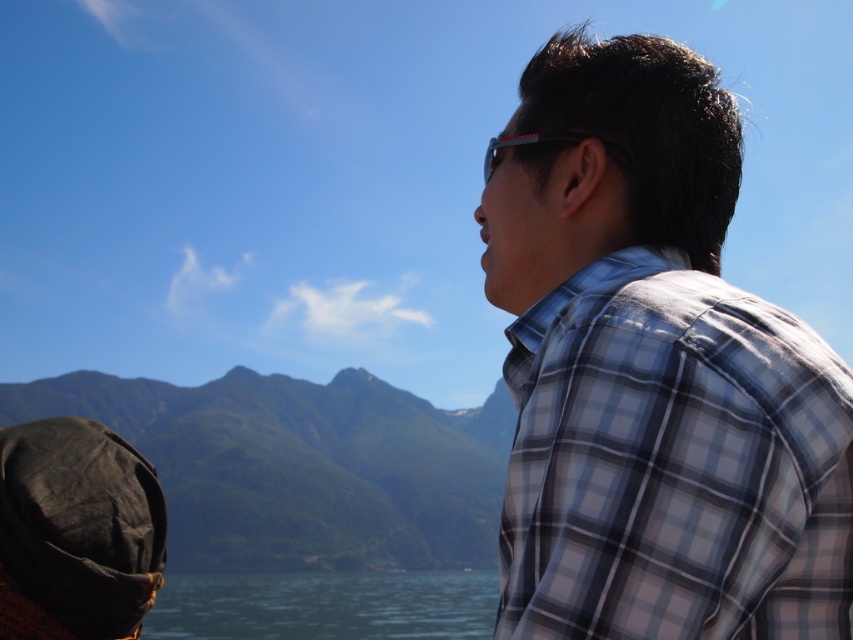
What is the exact position of the plaid fabric shirt at right in the image?

The plaid fabric shirt at right is located at point [654,372].

You are a photographer trying to capture the plaid fabric shirt at right and the green matte mountain at left in a single shot. Will the mountain be visible behind the shirt?

The plaid fabric shirt at right is in front of the green matte mountain at left, so the mountain will not be fully visible behind the shirt in the photo.